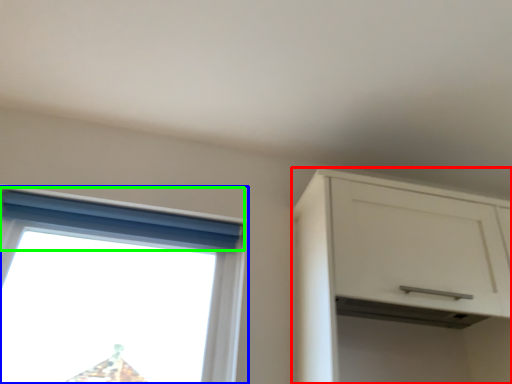
Question: Based on their relative distances, which object is farther from cabinetry (highlighted by a red box)? Choose from window (highlighted by a blue box) and curtain (highlighted by a green box).

Choices:
 (A) window
 (B) curtain

Answer: (A)